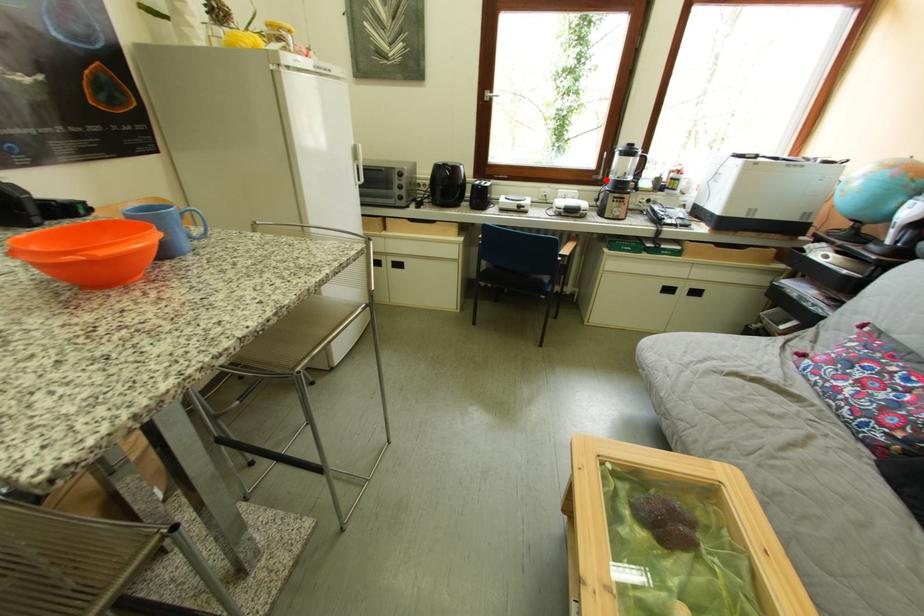
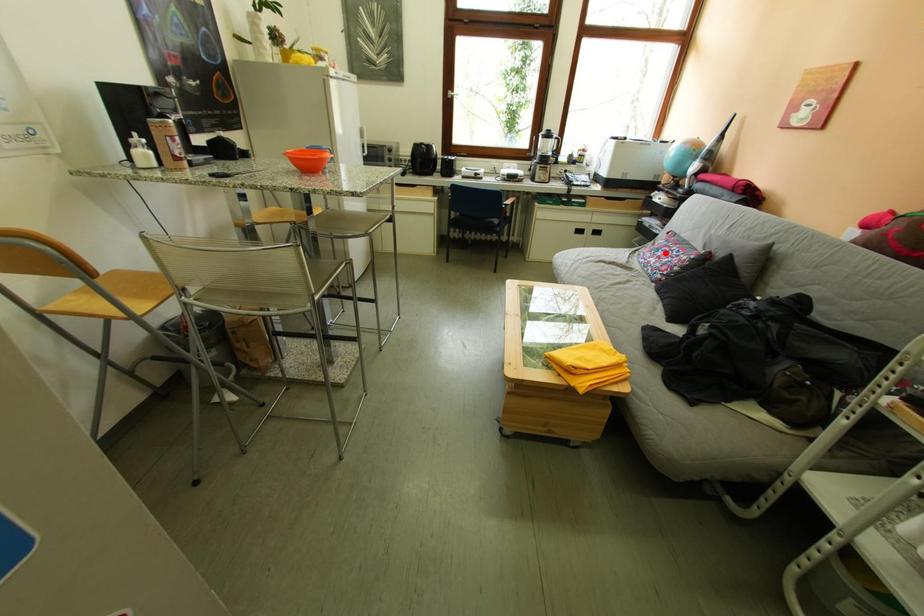
I am providing you with two images of the same scene from different viewpoints. A red point is marked on the first image and another point is marked on the second image. Do the highlighted points in image1 and image2 indicate the same real-world spot?

No